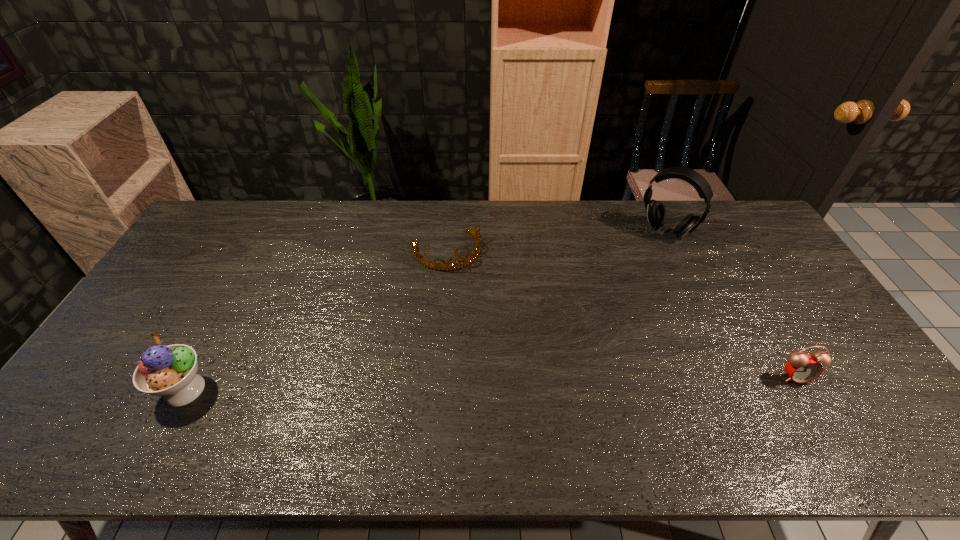
Locate an element on the screen. The width and height of the screenshot is (960, 540). vacant space on the desktop that is between the leftmost object and the third tallest object and is positioned on the front-facing side of the shortest object is located at coordinates click(x=503, y=383).

This screenshot has width=960, height=540. Identify the location of vacant space on the desktop that is between the third shortest object and the rightmost object and is positioned on the ear cups of the second object from right to left. (544, 382).